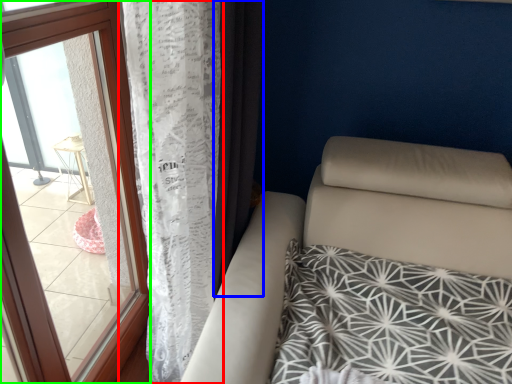
Question: Which object is positioned closest to curtain (highlighted by a red box)? Select from curtain (highlighted by a blue box) and window (highlighted by a green box).

Choices:
 (A) curtain
 (B) window

Answer: (A)